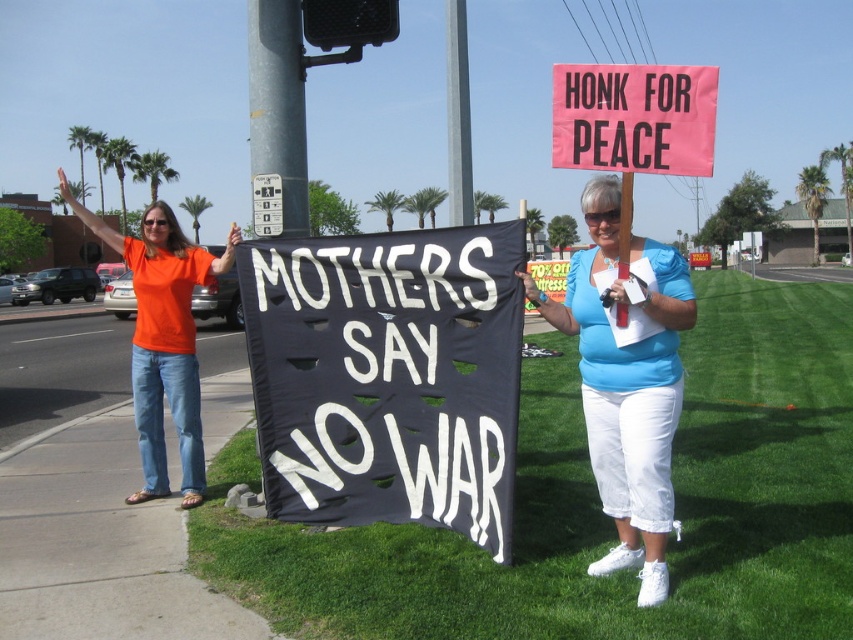
Which of these two, pink paper sign at upper center or gray concrete pole at upper center, stands taller?

gray concrete pole at upper center is taller.

Which is behind, point (706, 161) or point (448, 72)?

Positioned behind is point (448, 72).

Which is in front, point (584, 83) or point (456, 192)?

Positioned in front is point (584, 83).

Where is `pink paper sign at upper center`? The image size is (853, 640). pink paper sign at upper center is located at coordinates (634, 116).

From the picture: Is orange t-shirt at left bigger than metallic silver street sign at upper center?

Indeed, orange t-shirt at left has a larger size compared to metallic silver street sign at upper center.

Who is more forward, [183,458] or [267,186]?

Point [183,458]

The height and width of the screenshot is (640, 853). I want to click on orange t-shirt at left, so click(x=163, y=339).

This screenshot has height=640, width=853. What do you see at coordinates (277, 106) in the screenshot?
I see `metallic gray pole at center` at bounding box center [277, 106].

Between point (265, 68) and point (469, 132), which one is positioned behind?

Point (469, 132)

Where is `metallic gray pole at center`? metallic gray pole at center is located at coordinates (277, 106).